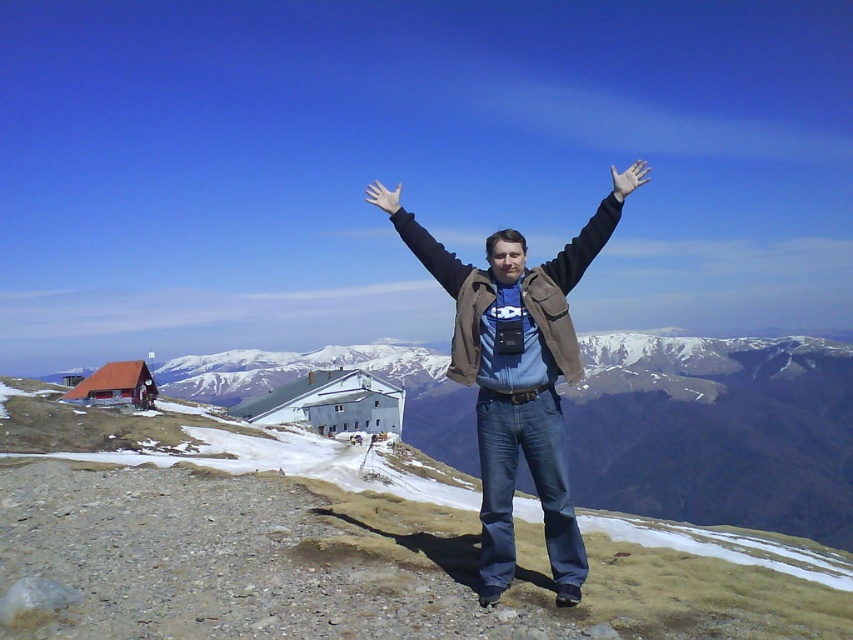
Can you confirm if black matte arm at center is wider than white matte hand at upper center?

In fact, black matte arm at center might be narrower than white matte hand at upper center.

Is point (397, 196) positioned behind point (614, 180)?

Yes, it is.

Is point (444, 262) positioned in front of point (625, 170)?

That is True.

Identify the location of black matte arm at center. (419, 240).

Does black matte arm at center appear on the right side of white rubber glove at center?

Yes, black matte arm at center is to the right of white rubber glove at center.

Between black matte arm at center and white rubber glove at center, which one has more height?

white rubber glove at center is taller.

This screenshot has height=640, width=853. What are the coordinates of `black matte arm at center` in the screenshot? It's located at (419, 240).

The width and height of the screenshot is (853, 640). What are the coordinates of `black matte arm at center` in the screenshot? It's located at (419, 240).

Is brown leather jacket at center below black matte arm at center?

Yes.

Who is positioned more to the left, brown leather jacket at center or black matte arm at center?

black matte arm at center

Does point (498, 513) lie in front of point (410, 246)?

Yes, it is in front of point (410, 246).

Find the location of a particular element. This screenshot has width=853, height=640. brown leather jacket at center is located at coordinates (517, 381).